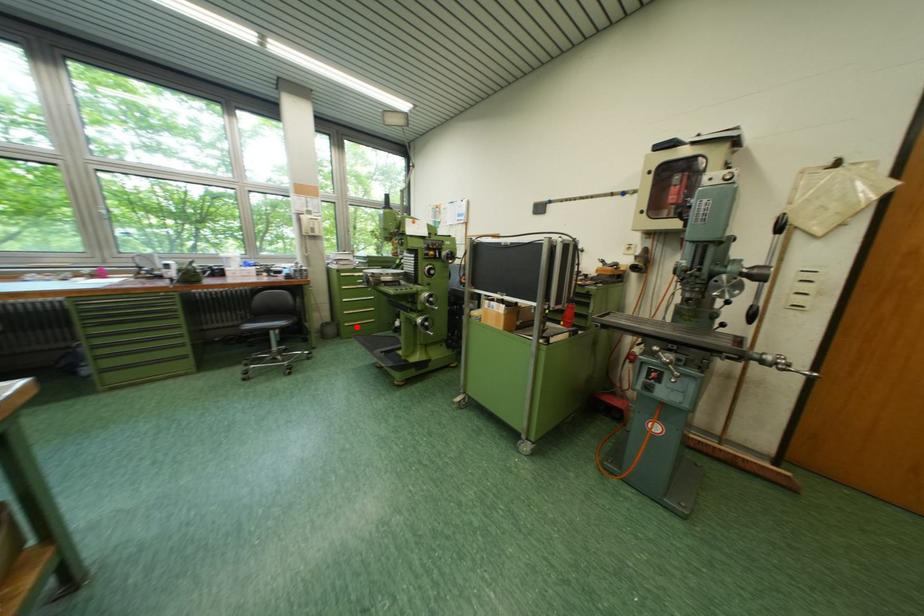
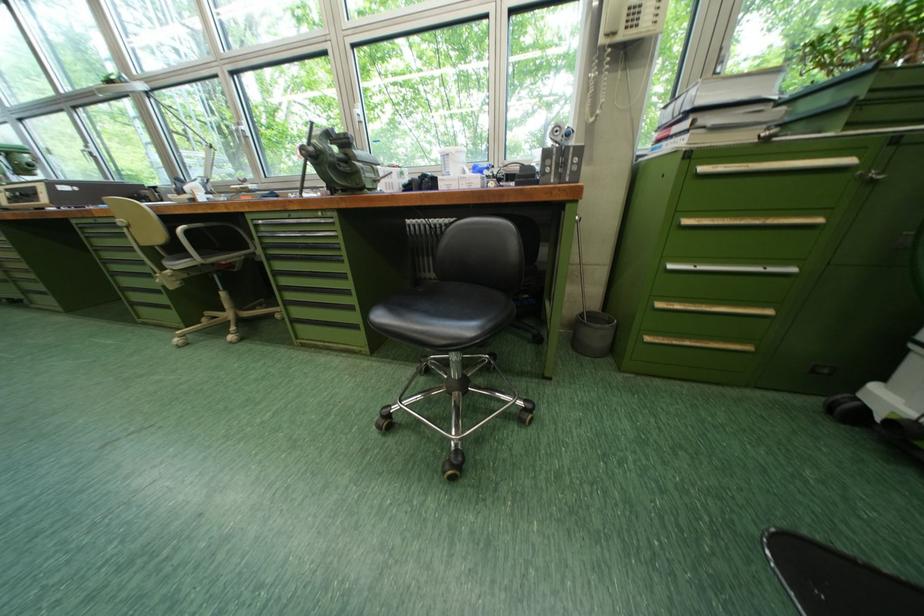
Where in the second image is the point corresponding to the highlighted location from the first image?

(659, 341)